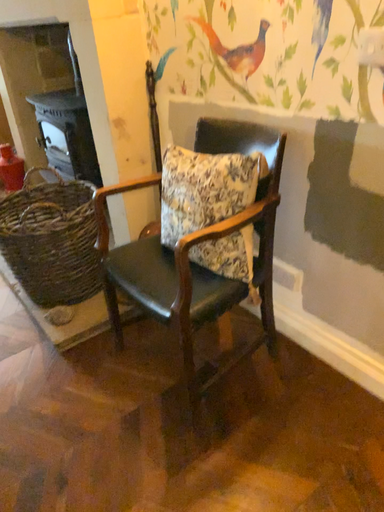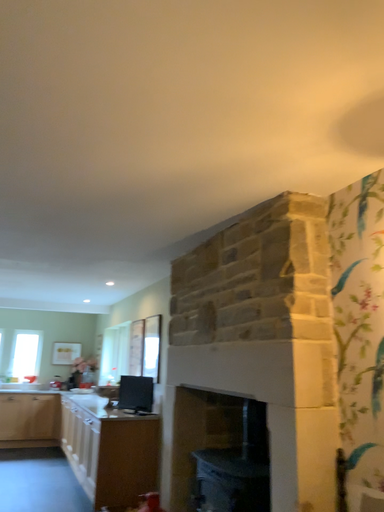
Question: How did the camera likely rotate when shooting the video?

Choices:
 (A) rotated left
 (B) rotated right

Answer: (A)